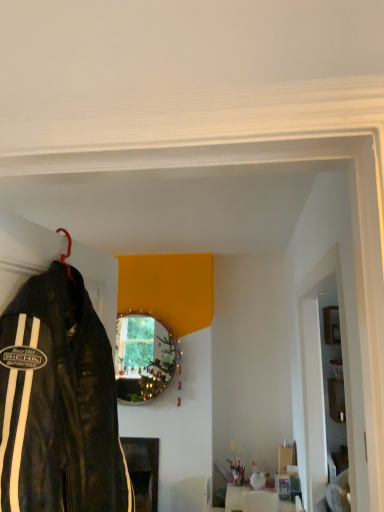
Question: Considering the positions of metallic dark brown fireplace at lower center, which is the first furniture in back-to-front order, and white glossy vase at center, the second furniture in the back-to-front sequence, in the image, is metallic dark brown fireplace at lower center, which is the first furniture in back-to-front order, wider or thinner than white glossy vase at center, the second furniture in the back-to-front sequence,?

Choices:
 (A) thin
 (B) wide

Answer: (B)

Question: From a real-world perspective, is metallic dark brown fireplace at lower center, placed as the second furniture when sorted from right to left, positioned above or below white glossy vase at center, the second furniture in the back-to-front sequence?

Choices:
 (A) below
 (B) above

Answer: (B)

Question: Estimate the real-world distances between objects in this image. Which object is farther from the white glossy vase at center, which is the 1th furniture from right to left?

Choices:
 (A) white glossy door at right
 (B) metallic dark brown fireplace at lower center, which is the first furniture in back-to-front order
 (C) black leather jacket at left
 (D) metallic reflective mirror at center

Answer: (C)

Question: Estimate the real-world distances between objects in this image. Which object is closer to the metallic reflective mirror at center?

Choices:
 (A) black leather jacket at left
 (B) white glossy door at right
 (C) white glossy vase at center, which is the 1th furniture from right to left
 (D) metallic dark brown fireplace at lower center, acting as the second furniture starting from the front

Answer: (D)